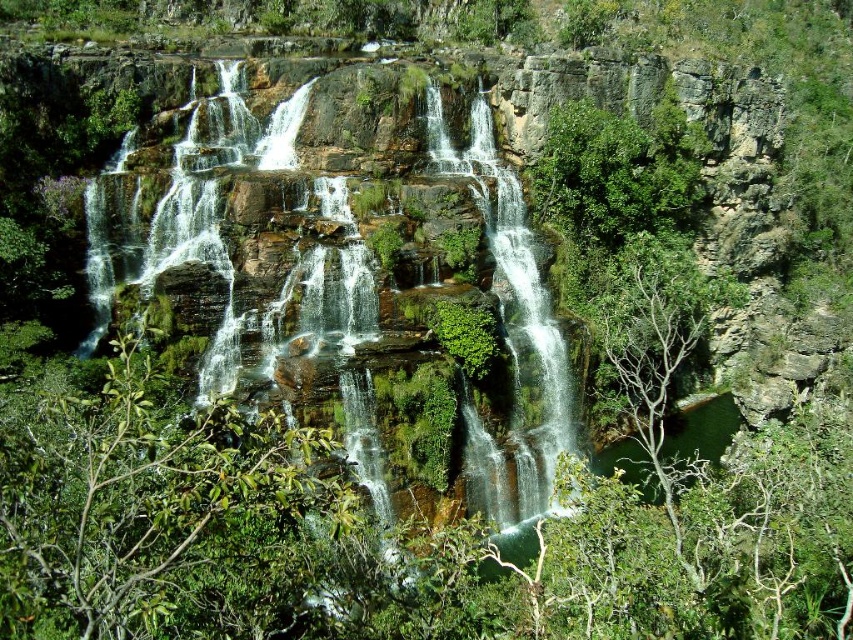
Which of these two, green leafy tree at center or green mossy rock at center, stands shorter?

green leafy tree at center

Is green leafy tree at center thinner than green mossy rock at center?

In fact, green leafy tree at center might be wider than green mossy rock at center.

Does point (234, 460) come behind point (514, 232)?

No.

This screenshot has height=640, width=853. Identify the location of green leafy tree at center. (155, 509).

Is white frothy water at center above green mossy rock at center?

Correct, white frothy water at center is located above green mossy rock at center.

Which is behind, point (432, 163) or point (496, 278)?

Positioned behind is point (432, 163).

Locate an element on the screen. white frothy water at center is located at coordinates (511, 340).

Is the position of green leafy tree at center more distant than that of white frothy water at center?

No, green leafy tree at center is in front of white frothy water at center.

Can you confirm if green leafy tree at center is positioned below white frothy water at center?

Indeed, green leafy tree at center is positioned under white frothy water at center.

Between point (250, 531) and point (544, 440), which one is positioned behind?

Positioned behind is point (544, 440).

This screenshot has height=640, width=853. I want to click on green leafy tree at center, so click(155, 509).